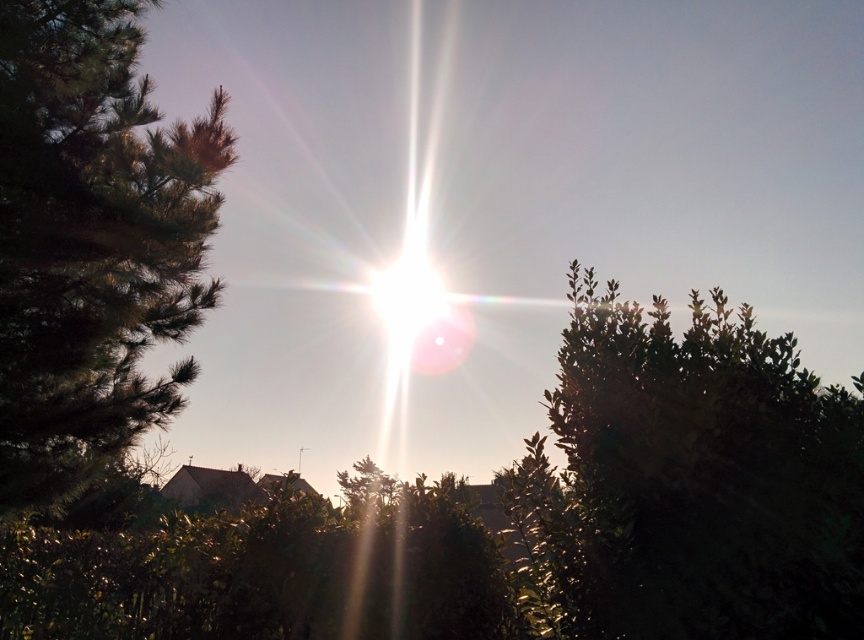
Question: Does green leafy bush at upper right come behind green leafy tree at left?

Choices:
 (A) no
 (B) yes

Answer: (A)

Question: Observing the image, what is the correct spatial positioning of green leafy bush at upper right in reference to green leafy tree at left?

Choices:
 (A) below
 (B) above

Answer: (A)

Question: Among these objects, which one is nearest to the camera?

Choices:
 (A) green leafy bush at upper right
 (B) green leafy tree at left

Answer: (A)

Question: Does green leafy bush at upper right lie in front of green leafy tree at left?

Choices:
 (A) no
 (B) yes

Answer: (B)

Question: Which object is closer to the camera taking this photo?

Choices:
 (A) green leafy tree at left
 (B) green leafy bush at upper right

Answer: (B)